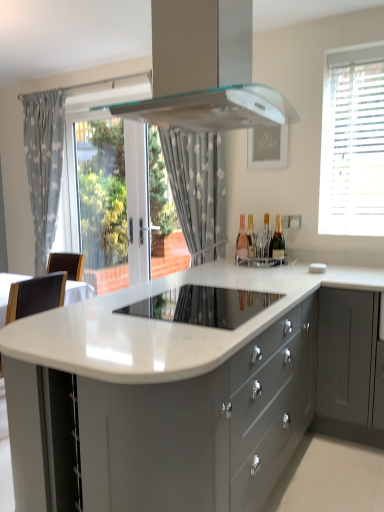
The height and width of the screenshot is (512, 384). Find the location of `blank space situated above transparent glass door at left (from a real-world perspective)`. blank space situated above transparent glass door at left (from a real-world perspective) is located at coordinates (95, 109).